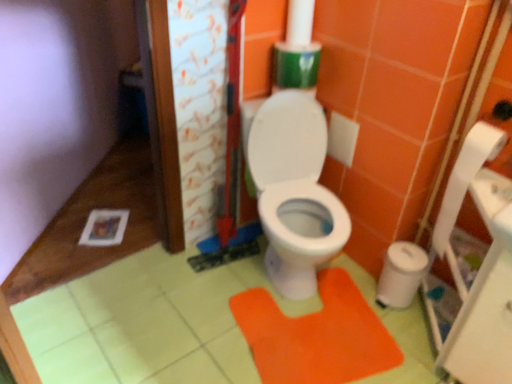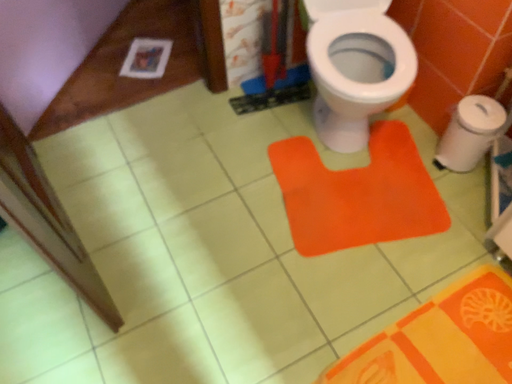
Question: Which way did the camera rotate in the video?

Choices:
 (A) rotated downward
 (B) rotated upward

Answer: (A)